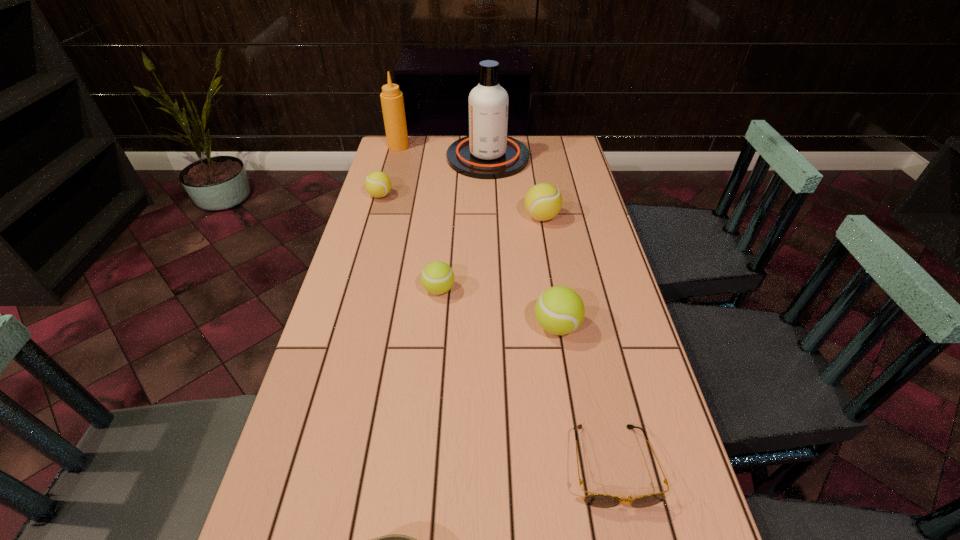
Locate an element on the screen. The image size is (960, 540). the tallest object is located at coordinates (487, 153).

This screenshot has width=960, height=540. Identify the location of cleansing agent. (487, 153).

Find the location of a particular element. the second tallest object is located at coordinates (392, 102).

The width and height of the screenshot is (960, 540). Identify the location of tan condiment. (392, 102).

You are a GUI agent. You are given a task and a screenshot of the screen. Output one action in this format:
    pyautogui.click(x=<x>, y=<y>)
    Task: Click on the right yellow tennis ball
    The height and width of the screenshot is (540, 960).
    Given the screenshot: What is the action you would take?
    (x=543, y=201)

In order to click on the fifth nearest object in this screenshot , I will do (x=543, y=201).

This screenshot has height=540, width=960. What are the coordinates of `the third nearest object` in the screenshot? It's located at tap(559, 310).

Locate an element on the screen. The height and width of the screenshot is (540, 960). the nearest tennis ball is located at coordinates (559, 310).

Identify the location of the smaller yellow tennis ball. The image size is (960, 540). (378, 184).

Locate an element on the screen. The image size is (960, 540). the farthest tennis ball is located at coordinates (378, 184).